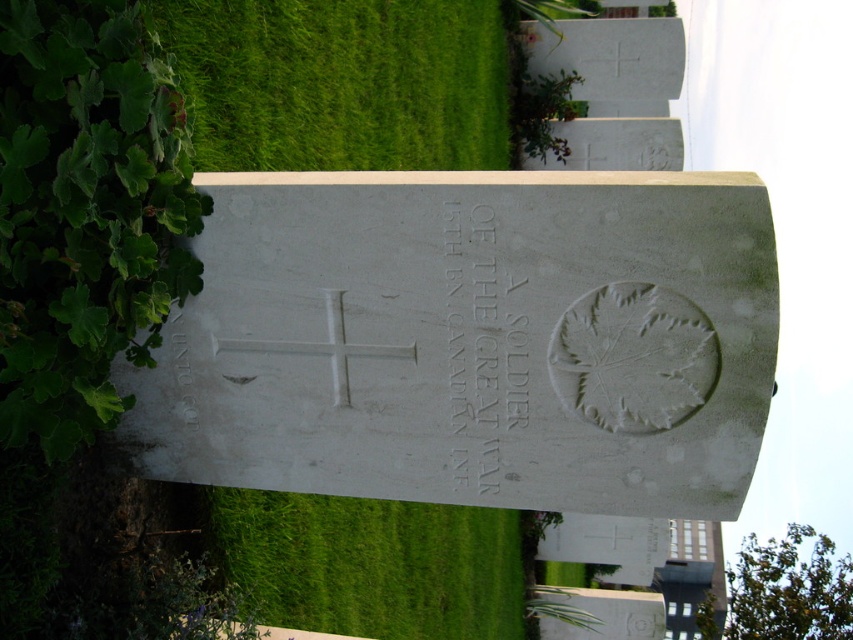
Question: Is green grass at upper left to the left of green leafy hedge at upper center from the viewer's perspective?

Choices:
 (A) yes
 (B) no

Answer: (A)

Question: Observing the image, what is the correct spatial positioning of green grass at upper left in reference to white stone inscription at center?

Choices:
 (A) right
 (B) left

Answer: (B)

Question: Can you confirm if white stone inscription at center is positioned to the right of green leafy hedge at upper center?

Choices:
 (A) yes
 (B) no

Answer: (B)

Question: Considering the real-world distances, which object is closest to the green leafy hedge at upper center?

Choices:
 (A) white stone inscription at center
 (B) green grass at upper left

Answer: (B)

Question: Among these objects, which one is farthest from the camera?

Choices:
 (A) green grass at upper left
 (B) green leafy hedge at upper center

Answer: (B)

Question: Which object appears farthest from the camera in this image?

Choices:
 (A) green grass at upper left
 (B) green leafy hedge at upper center
 (C) white stone inscription at center

Answer: (B)